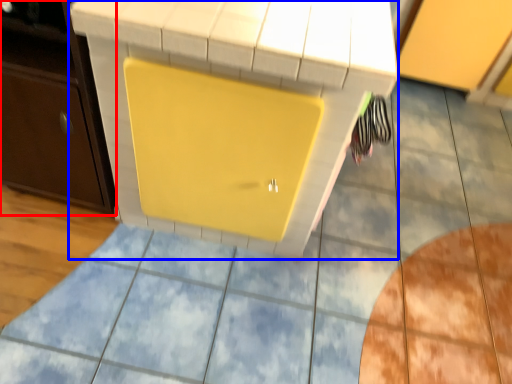
Question: Which point is closer to the camera, cabinetry (highlighted by a red box) or vanity (highlighted by a blue box)?

Choices:
 (A) cabinetry
 (B) vanity

Answer: (B)